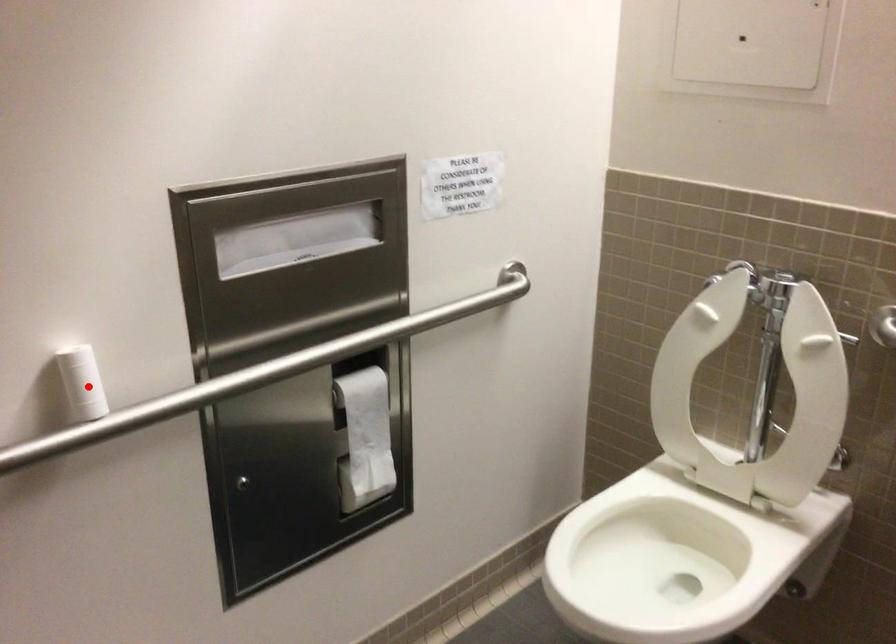
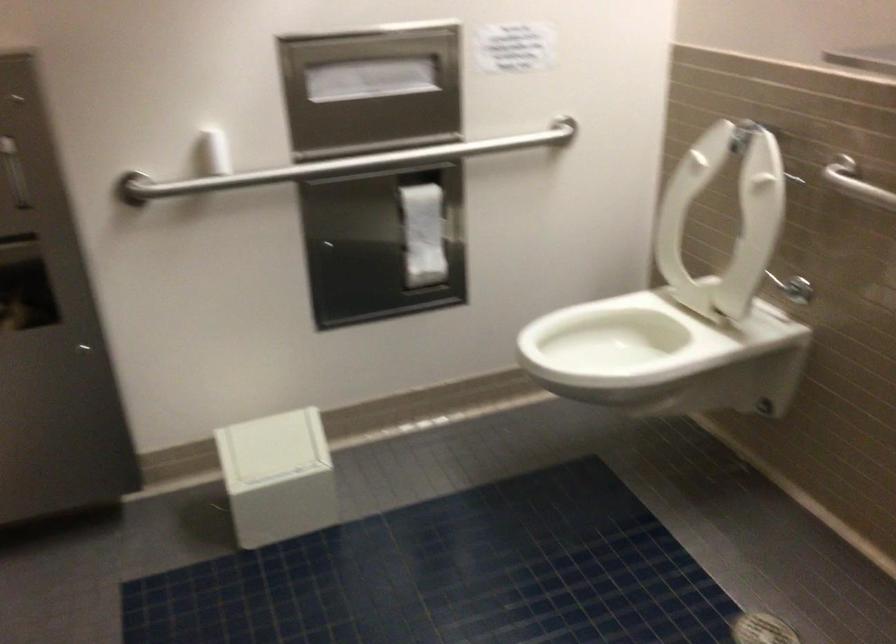
Question: I am providing you with two images of the same scene from different viewpoints. Image1 has a red point marked. In image2, the corresponding 3D location appears at what relative position? Reply with the corresponding letter.

Choices:
 (A) Closer
 (B) Farther

Answer: (B)